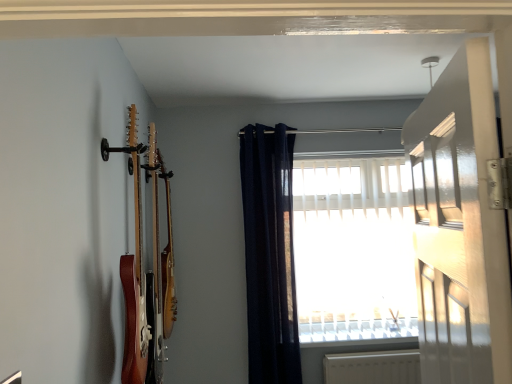
How much space does wooden acoustic guitar at left, which ranks as the second guitar in front-to-back order, occupy horizontally?

11.85 centimeters.

The width and height of the screenshot is (512, 384). Identify the location of white translucent blinds at center. (353, 250).

At what (x,y) coordinates should I click in order to perform the action: click on wooden acoustic guitar at left, which ranks as the second guitar in front-to-back order. Please return your answer as a coordinate pair (x, y). Looking at the image, I should click on (167, 260).

Is navy blue fabric curtain at upper center behind wooden acoustic guitar at left, placed as the second guitar when sorted from back to front?

Yes, navy blue fabric curtain at upper center is further from the camera.

Between navy blue fabric curtain at upper center and wooden acoustic guitar at left, the 1th guitar positioned from the front, which one appears on the left side from the viewer's perspective?

From the viewer's perspective, wooden acoustic guitar at left, the 1th guitar positioned from the front, appears more on the left side.

Does navy blue fabric curtain at upper center have a greater width compared to wooden acoustic guitar at left, the 1th guitar positioned from the front?

Indeed, navy blue fabric curtain at upper center has a greater width compared to wooden acoustic guitar at left, the 1th guitar positioned from the front.

What's the angular difference between navy blue fabric curtain at upper center and wooden acoustic guitar at left, placed as the second guitar when sorted from back to front,'s facing directions?

92.2 degrees separate the facing orientations of navy blue fabric curtain at upper center and wooden acoustic guitar at left, placed as the second guitar when sorted from back to front.

There is a white plastic window sill at lower center. Where is `the 1st guitar above it (from a real-world perspective)`? Image resolution: width=512 pixels, height=384 pixels. the 1st guitar above it (from a real-world perspective) is located at coordinates (167, 260).

Is wooden acoustic guitar at left, which is the 1th guitar from back to front, aimed at white plastic window sill at lower center?

No, wooden acoustic guitar at left, which is the 1th guitar from back to front, is not aimed at white plastic window sill at lower center.

Would you say wooden acoustic guitar at left, which ranks as the second guitar in front-to-back order, is outside white plastic window sill at lower center?

Yes, wooden acoustic guitar at left, which ranks as the second guitar in front-to-back order, is not within white plastic window sill at lower center.

Consider the image. Is white glossy door at upper right surrounding navy blue fabric curtain at upper center?

That's incorrect, navy blue fabric curtain at upper center is not inside white glossy door at upper right.

Is white glossy door at upper right facing towards navy blue fabric curtain at upper center?

No, white glossy door at upper right does not turn towards navy blue fabric curtain at upper center.

Visually, is white glossy door at upper right positioned to the left or to the right of navy blue fabric curtain at upper center?

From the image, it's evident that white glossy door at upper right is to the right of navy blue fabric curtain at upper center.

Is point (444, 135) farther from viewer compared to point (269, 351)?

No, it is not.

How different are the orientations of wooden acoustic guitar at left, which is the 1th guitar from back to front, and white glossy door at upper right in degrees?

16.7 degrees separate the facing orientations of wooden acoustic guitar at left, which is the 1th guitar from back to front, and white glossy door at upper right.

From their relative heights in the image, would you say wooden acoustic guitar at left, which ranks as the second guitar in front-to-back order, is taller or shorter than white glossy door at upper right?

In the image, wooden acoustic guitar at left, which ranks as the second guitar in front-to-back order, appears to be taller than white glossy door at upper right.

From the image's perspective, is wooden acoustic guitar at left, which ranks as the second guitar in front-to-back order, under white glossy door at upper right?

Indeed, from the image's perspective, wooden acoustic guitar at left, which ranks as the second guitar in front-to-back order, is shown beneath white glossy door at upper right.

Is wooden acoustic guitar at left, which ranks as the second guitar in front-to-back order, positioned with its back to white glossy door at upper right?

wooden acoustic guitar at left, which ranks as the second guitar in front-to-back order, is not turned away from white glossy door at upper right.

How many degrees apart are the facing directions of wooden acoustic guitar at left, placed as the second guitar when sorted from back to front, and white glossy door at upper right?

The angle between the facing direction of wooden acoustic guitar at left, placed as the second guitar when sorted from back to front, and the facing direction of white glossy door at upper right is 19.3 degrees.

From a real-world perspective, is wooden acoustic guitar at left, placed as the second guitar when sorted from back to front, physically located above or below white glossy door at upper right?

Clearly, from a real-world perspective, wooden acoustic guitar at left, placed as the second guitar when sorted from back to front, is above white glossy door at upper right.

Locate an element on the screen. guitar that is the 1st one when counting downward from the white glossy door at upper right (from the image's perspective) is located at coordinates (134, 272).

Is wooden acoustic guitar at left, placed as the second guitar when sorted from back to front, facing away from white glossy door at upper right?

No, wooden acoustic guitar at left, placed as the second guitar when sorted from back to front,'s orientation is not away from white glossy door at upper right.

Can you tell me how much navy blue fabric curtain at upper center and white plastic window sill at lower center differ in facing direction?

navy blue fabric curtain at upper center and white plastic window sill at lower center are facing 2.19 degrees away from each other.

Where is `curtain above the white plastic window sill at lower center (from the image's perspective)`? This screenshot has height=384, width=512. curtain above the white plastic window sill at lower center (from the image's perspective) is located at coordinates (269, 254).

Who is shorter, navy blue fabric curtain at upper center or white plastic window sill at lower center?

white plastic window sill at lower center is shorter.

Is navy blue fabric curtain at upper center to the right of white plastic window sill at lower center from the viewer's perspective?

Incorrect, navy blue fabric curtain at upper center is not on the right side of white plastic window sill at lower center.

Is navy blue fabric curtain at upper center facing away from white glossy door at upper right?

No, navy blue fabric curtain at upper center is not facing the opposite direction of white glossy door at upper right.

Considering the relative sizes of navy blue fabric curtain at upper center and white glossy door at upper right in the image provided, is navy blue fabric curtain at upper center thinner than white glossy door at upper right?

No, navy blue fabric curtain at upper center is not thinner than white glossy door at upper right.

Is point (291, 282) more distant than point (440, 217)?

Yes, it is behind point (440, 217).

From the image's perspective, between navy blue fabric curtain at upper center and white glossy door at upper right, who is located below?

navy blue fabric curtain at upper center.

Identify the location of curtain on the right of wooden acoustic guitar at left, placed as the second guitar when sorted from back to front. The width and height of the screenshot is (512, 384). (269, 254).

You are a GUI agent. You are given a task and a screenshot of the screen. Output one action in this format:
    pyautogui.click(x=<x>, y=<y>)
    Task: Click on the window sill below the wooden acoustic guitar at left, which ranks as the second guitar in front-to-back order (from a real-world perspective)
    This screenshot has height=384, width=512.
    Given the screenshot: What is the action you would take?
    pyautogui.click(x=355, y=330)

Based on their spatial positions, is navy blue fabric curtain at upper center or white plastic window sill at lower center closer to white translucent blinds at center?

white plastic window sill at lower center is closer to white translucent blinds at center.

Based on the photo, looking at the image, which one is located further to white translucent blinds at center, wooden acoustic guitar at left, which is the 1th guitar from back to front, or wooden acoustic guitar at left, placed as the second guitar when sorted from back to front?

Among the two, wooden acoustic guitar at left, placed as the second guitar when sorted from back to front, is located further to white translucent blinds at center.

From the image, which object appears to be farther from white plastic window sill at lower center, navy blue fabric curtain at upper center or wooden acoustic guitar at left, which is the 1th guitar from back to front?

wooden acoustic guitar at left, which is the 1th guitar from back to front.

Based on their spatial positions, is wooden acoustic guitar at left, placed as the second guitar when sorted from back to front, or wooden acoustic guitar at left, which is the 1th guitar from back to front, closer to white plastic window sill at lower center?

wooden acoustic guitar at left, which is the 1th guitar from back to front, is closer to white plastic window sill at lower center.

Estimate the real-world distances between objects in this image. Which object is closer to white translucent blinds at center, wooden acoustic guitar at left, which ranks as the second guitar in front-to-back order, or white plastic window sill at lower center?

Based on the image, white plastic window sill at lower center appears to be nearer to white translucent blinds at center.

Looking at this image, which object lies nearer to the anchor point white glossy door at upper right, white plastic window sill at lower center or wooden acoustic guitar at left, which is the 1th guitar from back to front?

The object closer to white glossy door at upper right is wooden acoustic guitar at left, which is the 1th guitar from back to front.

Which object lies nearer to the anchor point navy blue fabric curtain at upper center, white plastic window sill at lower center or wooden acoustic guitar at left, the 1th guitar positioned from the front?

white plastic window sill at lower center.

When comparing their distances from white plastic window sill at lower center, does navy blue fabric curtain at upper center or wooden acoustic guitar at left, placed as the second guitar when sorted from back to front, seem closer?

navy blue fabric curtain at upper center is positioned closer to the anchor white plastic window sill at lower center.

At what (x,y) coordinates should I click in order to perform the action: click on curtain located between wooden acoustic guitar at left, placed as the second guitar when sorted from back to front, and white plastic window sill at lower center in the depth direction. Please return your answer as a coordinate pair (x, y). Looking at the image, I should click on (269, 254).

This screenshot has width=512, height=384. I want to click on curtain located between white glossy door at upper right and white plastic window sill at lower center in the depth direction, so click(x=269, y=254).

Where is `guitar between wooden acoustic guitar at left, the 1th guitar positioned from the front, and navy blue fabric curtain at upper center from front to back`? Image resolution: width=512 pixels, height=384 pixels. guitar between wooden acoustic guitar at left, the 1th guitar positioned from the front, and navy blue fabric curtain at upper center from front to back is located at coordinates (167, 260).

This screenshot has height=384, width=512. I want to click on curtain positioned between white glossy door at upper right and white translucent blinds at center from near to far, so (x=269, y=254).